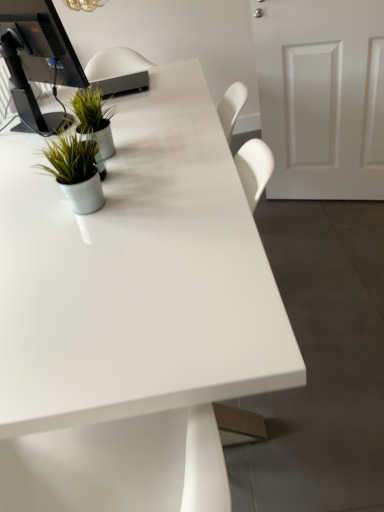
Question: From a real-world perspective, is white glossy desk at center positioned over white matte door at right based on gravity?

Choices:
 (A) no
 (B) yes

Answer: (A)

Question: Is white glossy desk at center further to camera compared to white matte door at right?

Choices:
 (A) no
 (B) yes

Answer: (A)

Question: Does white glossy desk at center have a larger size compared to white matte door at right?

Choices:
 (A) no
 (B) yes

Answer: (B)

Question: Considering the relative sizes of white glossy desk at center and white matte door at right in the image provided, is white glossy desk at center shorter than white matte door at right?

Choices:
 (A) no
 (B) yes

Answer: (B)

Question: Are white glossy desk at center and white matte door at right far apart?

Choices:
 (A) no
 (B) yes

Answer: (A)

Question: Is white glossy desk at center positioned in front of white matte door at right?

Choices:
 (A) yes
 (B) no

Answer: (A)

Question: From a real-world perspective, is metallic silver pot at left, marked as the first houseplant in a front-to-back arrangement, located beneath green matte plant at upper left, which is the 2th houseplant in bottom-to-top order?

Choices:
 (A) yes
 (B) no

Answer: (B)

Question: Does metallic silver pot at left, positioned as the 2th houseplant in back-to-front order, turn towards green matte plant at upper left, which is the 1th houseplant in back-to-front order?

Choices:
 (A) yes
 (B) no

Answer: (B)

Question: Can you confirm if metallic silver pot at left, the 2th houseplant in the top-to-bottom sequence, is positioned to the right of green matte plant at upper left, which is the 2th houseplant in bottom-to-top order?

Choices:
 (A) no
 (B) yes

Answer: (B)

Question: Is metallic silver pot at left, marked as the first houseplant in a front-to-back arrangement, positioned before green matte plant at upper left, marked as the second houseplant in a front-to-back arrangement?

Choices:
 (A) no
 (B) yes

Answer: (B)

Question: Does metallic silver pot at left, the 2th houseplant in the top-to-bottom sequence, have a greater height compared to green matte plant at upper left, arranged as the 1th houseplant when viewed from the top?

Choices:
 (A) no
 (B) yes

Answer: (A)

Question: Is green matte plant at upper left, arranged as the 1th houseplant when viewed from the top, located within metallic silver pot at left, positioned as the 2th houseplant in back-to-front order?

Choices:
 (A) no
 (B) yes

Answer: (A)

Question: Does green matte plant at upper left, which is the 2th houseplant in bottom-to-top order, turn towards metallic silver pot at left, marked as the first houseplant in a front-to-back arrangement?

Choices:
 (A) yes
 (B) no

Answer: (B)